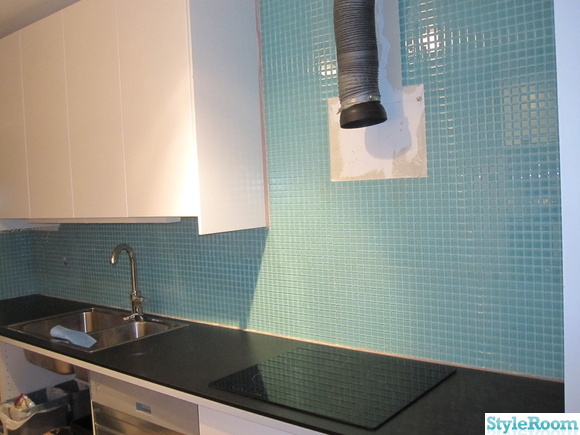
The width and height of the screenshot is (580, 435). I want to click on sink, so click(x=97, y=324).